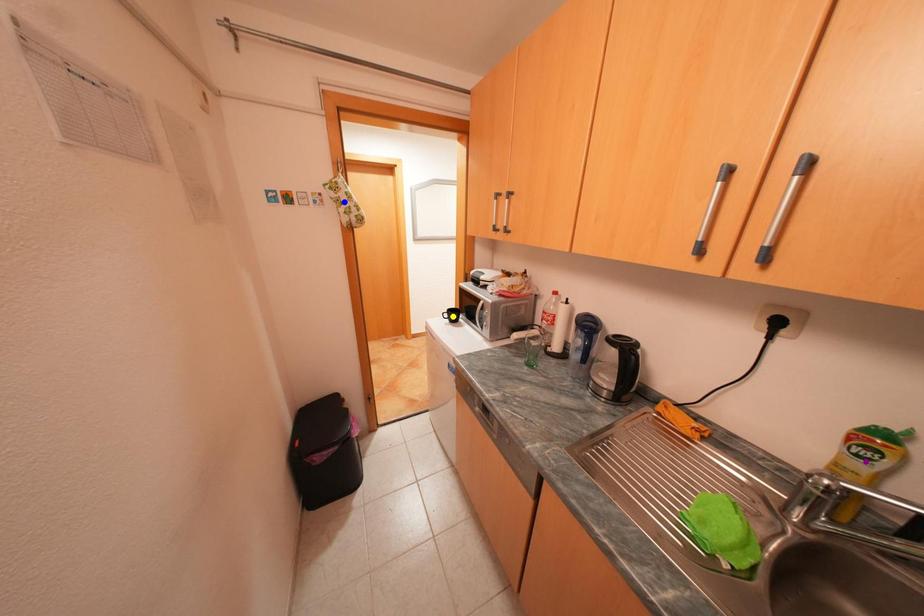
Order these from farthest to nearest:
blue point | purple point | yellow point

1. yellow point
2. blue point
3. purple point